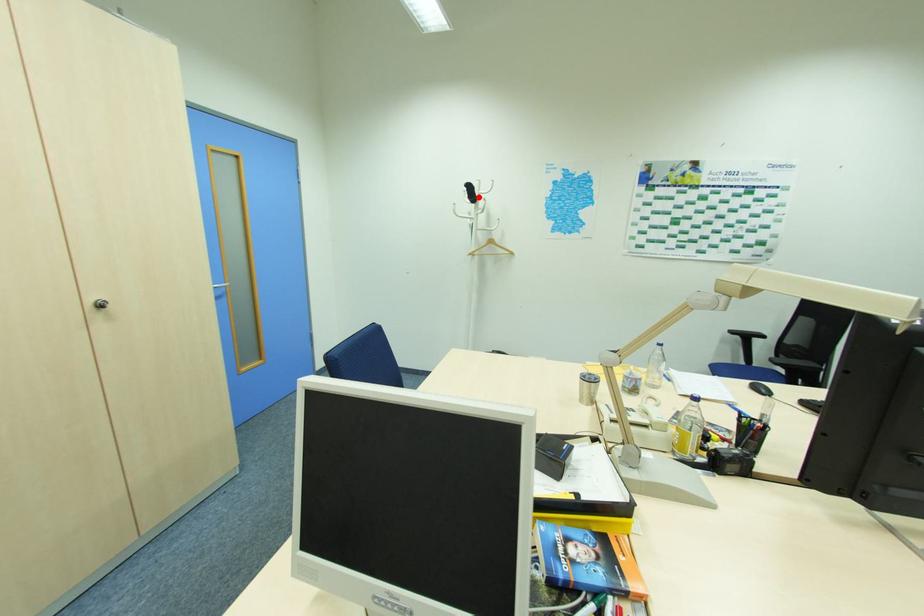
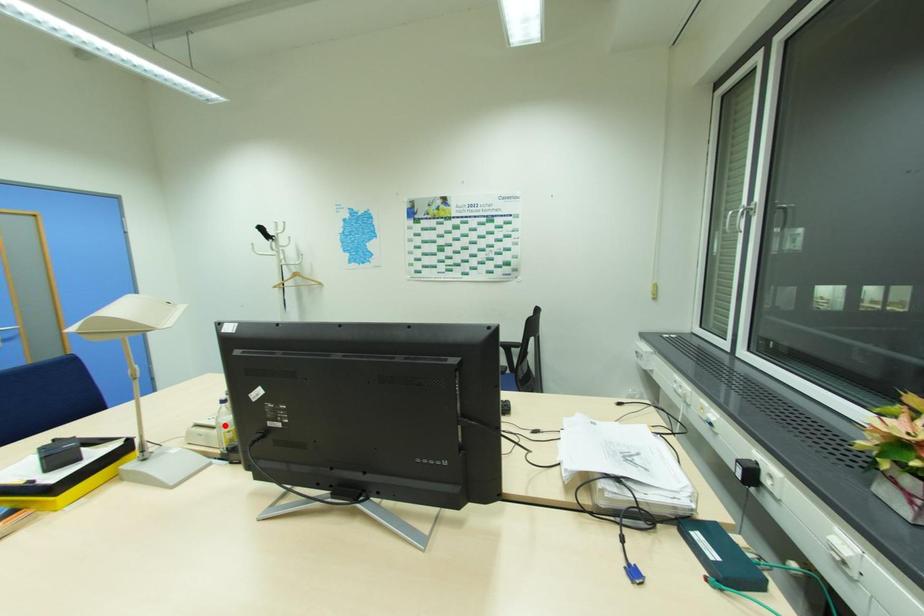
I am providing you with two images of the same scene from different viewpoints. A red point is marked on the first image and another point is marked on the second image. Is the marked point in image1 the same physical position as the marked point in image2?

No